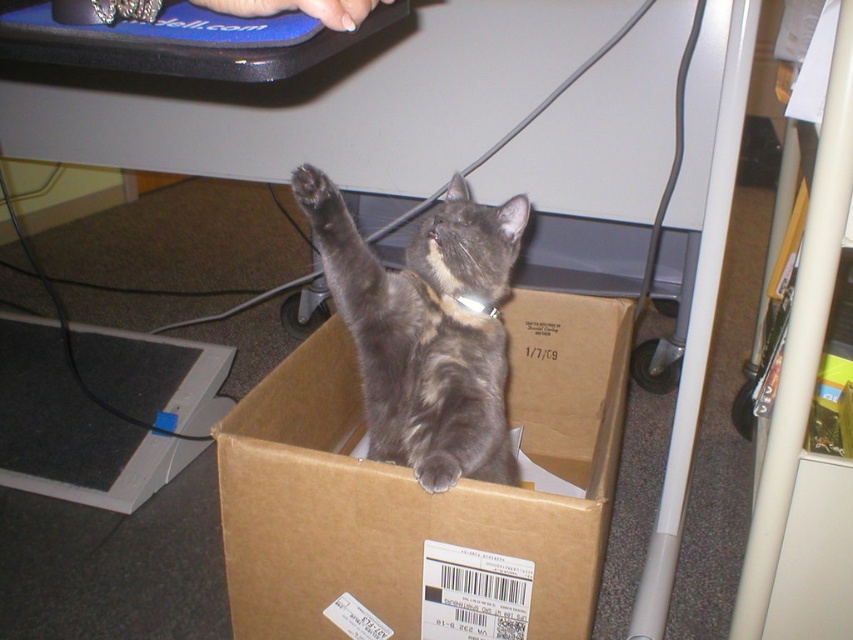
Can you confirm if gray fur paw at upper center is positioned above gray fur paw at lower center?

Correct, gray fur paw at upper center is located above gray fur paw at lower center.

Is point (328, 179) closer to viewer compared to point (436, 461)?

No, (328, 179) is behind (436, 461).

Which is behind, point (310, 205) or point (430, 451)?

Point (430, 451)

In order to click on gray fur paw at upper center in this screenshot , I will do `click(314, 189)`.

Does gray tabby cat at center lie behind gray fur paw at lower center?

Yes, gray tabby cat at center is further from the viewer.

Does point (439, 433) come in front of point (450, 476)?

That is False.

Find the location of a particular element. The width and height of the screenshot is (853, 640). gray tabby cat at center is located at coordinates (431, 332).

Does gray tabby cat at center have a greater height compared to gray fur paw at upper center?

Correct, gray tabby cat at center is much taller as gray fur paw at upper center.

Find the location of a particular element. The height and width of the screenshot is (640, 853). gray tabby cat at center is located at coordinates (431, 332).